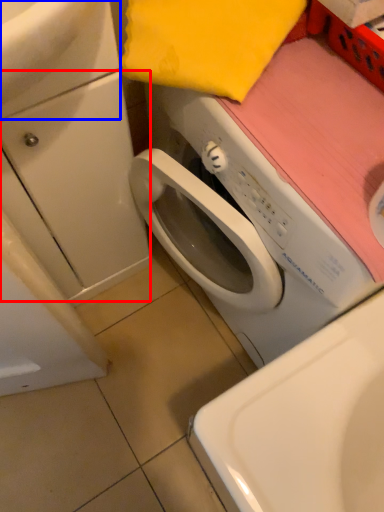
Question: Which of the following is the closest to the observer, drawer (highlighted by a red box) or sink (highlighted by a blue box)?

Choices:
 (A) drawer
 (B) sink

Answer: (B)